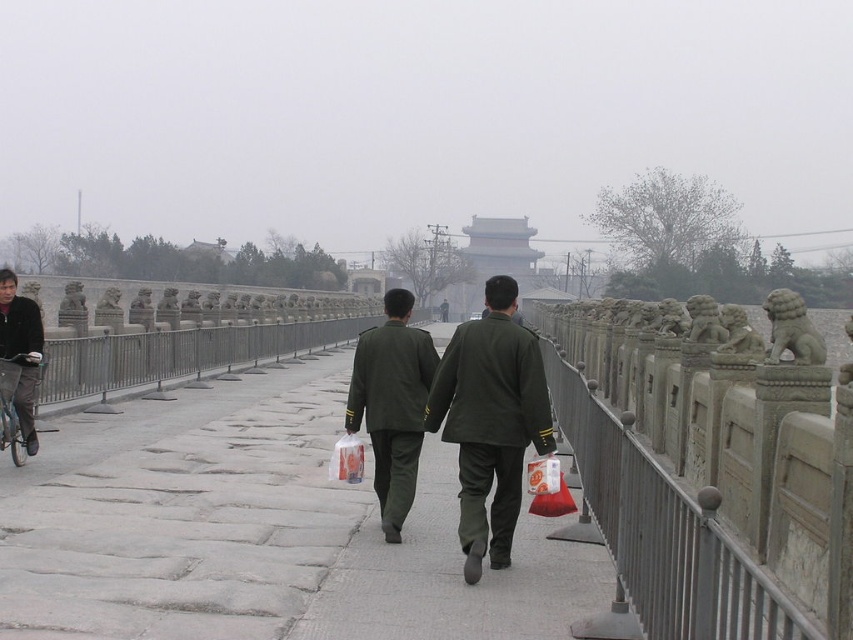
Consider the image. You are a photographer standing on the stone bridge and see two people wearing the matte green uniform at center and the green matte uniform at center. Which one is positioned to the right side from your perspective?

The matte green uniform at center is positioned to the right of the green matte uniform at center.

You are a photographer standing on the stone bridge and want to take a picture of both the matte green uniform at center and the green matte uniform at center. Given that your camera has a maximum focus range of 4 feet, will you be able to capture both subjects in focus without moving?

The distance between the matte green uniform at center and the green matte uniform at center is 4.24 feet. Since the camera can only focus up to 4 feet, the subjects are slightly out of the focus range. You might need to adjust your position or use a different camera setting to ensure both are in focus.

You are standing on the stone bridge and want to place a small decorative item exactly at the point marked by the coordinates point (706, 474). What object on the bridge is located at that point?

The point (706, 474) corresponds to the gray stone railing at right.